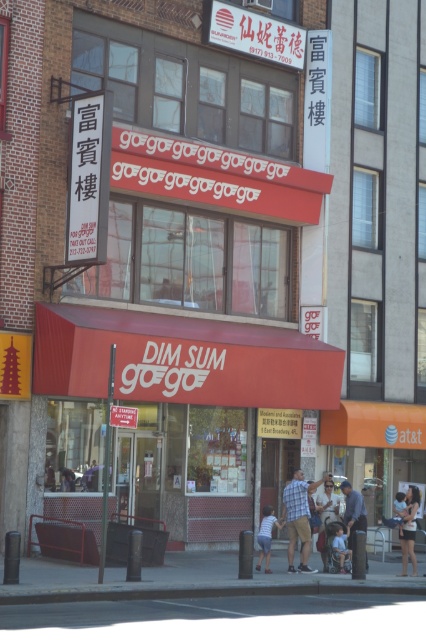
You are standing at the entrance of the restaurant and need to reach both the light blue denim jeans at lower right and the denim shorts at lower center. Which item is closer to you?

The denim shorts at lower center is closer to you since it is located at lower center compared to the light blue denim jeans at lower right, which is farther away.